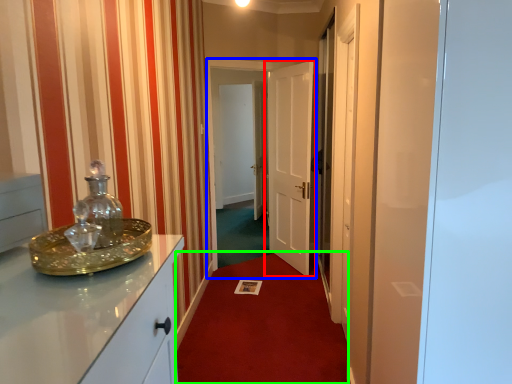
Question: Estimate the real-world distances between objects in this image. Which object is farther from door (highlighted by a red box), glass door (highlighted by a blue box) or plain (highlighted by a green box)?

Choices:
 (A) glass door
 (B) plain

Answer: (B)